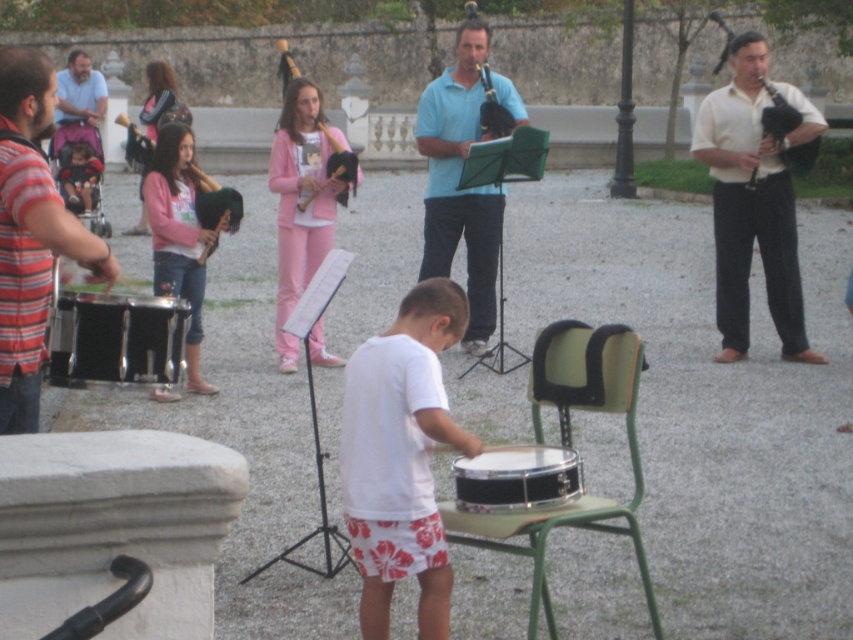
You are standing at the point labeled as point (12, 300) and want to walk towards the point labeled as point (560, 474). According to the scene description, will you have to walk past the boy playing the snare drum?

Yes, because point (12, 300) is behind point (560, 474), so you would need to walk past the boy playing the snare drum to reach your destination.

You are a photographer setting up for the outdoor musical performance. You need to ensure that the striped cotton shirt at left and the black drum at center are both visible in your shot. Based on their heights, which object should you adjust your camera angle to focus on first to capture both?

The striped cotton shirt at left is taller than the black drum at center, so you should focus on the striped cotton shirt at left first to ensure it fits within the frame before adjusting for the shorter black drum at center.

You are a photographer trying to capture a clear shot of the black drum at left and the pink fabric jacket at upper left. Which object should you focus on first to ensure both are in focus?

You should focus on the black drum at left first because it is closer to the viewer than the pink fabric jacket at upper left, so adjusting focus from near to far will help both be in focus.